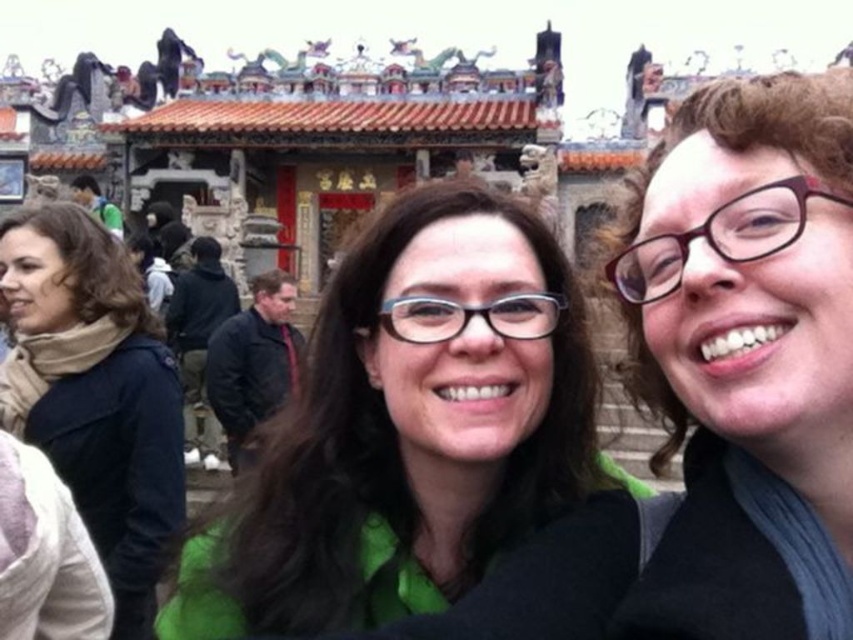
Question: Among these points, which one is nearest to the camera?

Choices:
 (A) (374, 413)
 (B) (100, 371)
 (C) (747, 372)

Answer: (C)

Question: Which point is closer to the camera taking this photo?

Choices:
 (A) (425, 202)
 (B) (764, 115)

Answer: (B)

Question: Is matte black glasses at upper right positioned before beige scarf at left?

Choices:
 (A) yes
 (B) no

Answer: (A)

Question: Observing the image, what is the correct spatial positioning of green matte shirt at center in reference to beige scarf at left?

Choices:
 (A) above
 (B) below

Answer: (B)

Question: Which object is the closest to the matte black glasses at upper right?

Choices:
 (A) green matte shirt at center
 (B) beige scarf at left

Answer: (A)

Question: Can you confirm if matte black glasses at upper right is positioned above beige scarf at left?

Choices:
 (A) no
 (B) yes

Answer: (B)